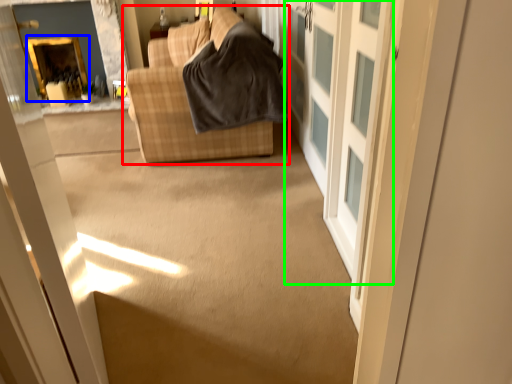
Question: Based on their relative distances, which object is farther from studio couch (highlighted by a red box)? Choose from fireplace (highlighted by a blue box) and barn door (highlighted by a green box).

Choices:
 (A) fireplace
 (B) barn door

Answer: (A)